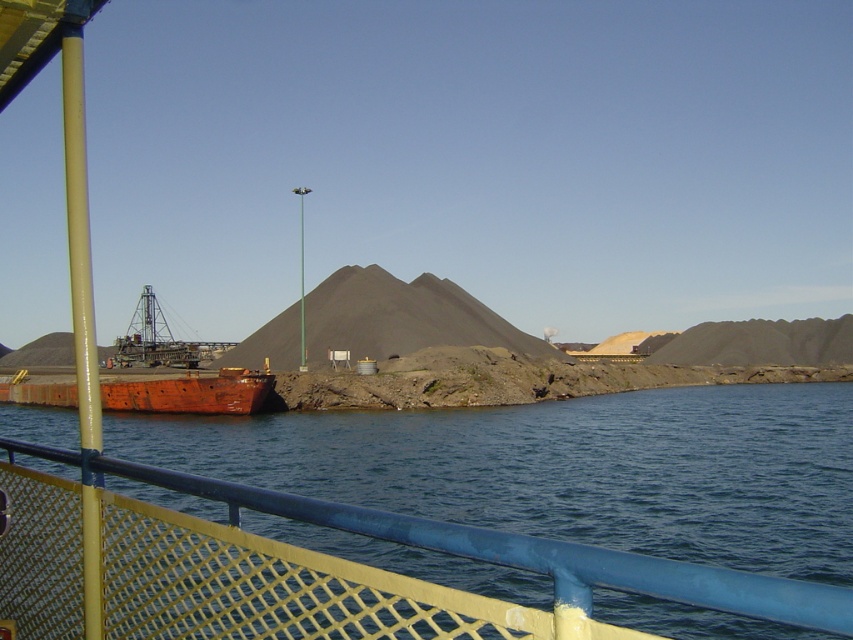
Question: Considering the relative positions of blue water at lower center and rusty metal boat at lower left in the image provided, where is blue water at lower center located with respect to rusty metal boat at lower left?

Choices:
 (A) right
 (B) left

Answer: (A)

Question: Which point is farther to the camera?

Choices:
 (A) rusty metal boat at lower left
 (B) blue water at lower center

Answer: (A)

Question: Is blue water at lower center smaller than rusty metal boat at lower left?

Choices:
 (A) yes
 (B) no

Answer: (B)

Question: Is blue water at lower center bigger than rusty metal boat at lower left?

Choices:
 (A) yes
 (B) no

Answer: (A)

Question: Among these points, which one is nearest to the camera?

Choices:
 (A) (115, 419)
 (B) (16, 401)

Answer: (A)